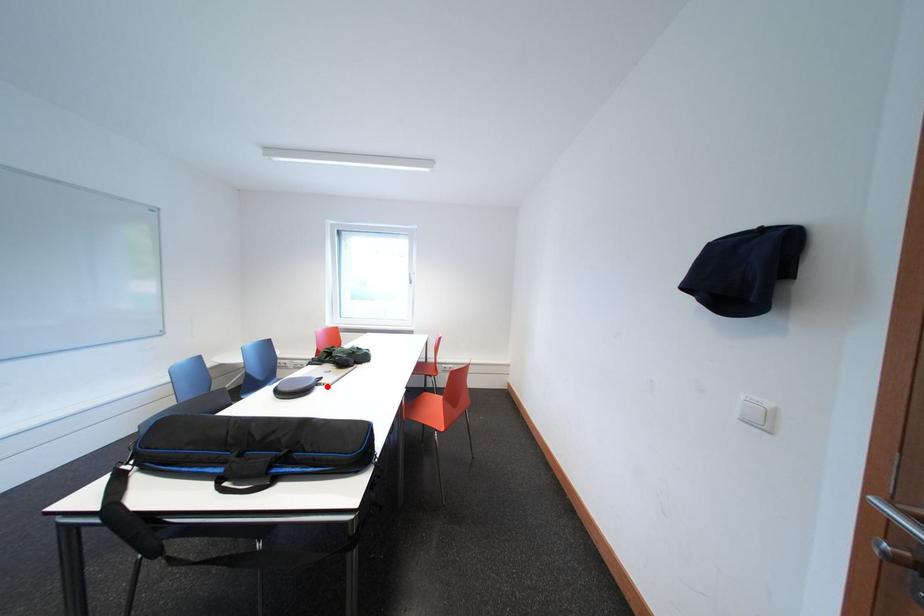
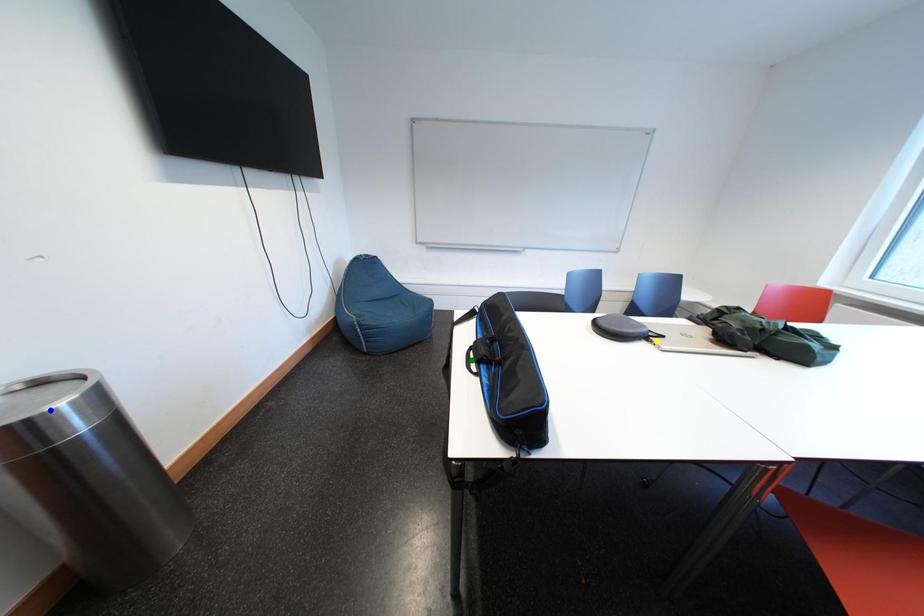
Question: I am providing you with two images of the same scene from different viewpoints. A red point is marked on the first image. You are given multiple points on the second image. Which point in image 2 represents the same 3d spot as the red point in image 1?

Choices:
 (A) yellow point
 (B) blue point
 (C) green point

Answer: (A)